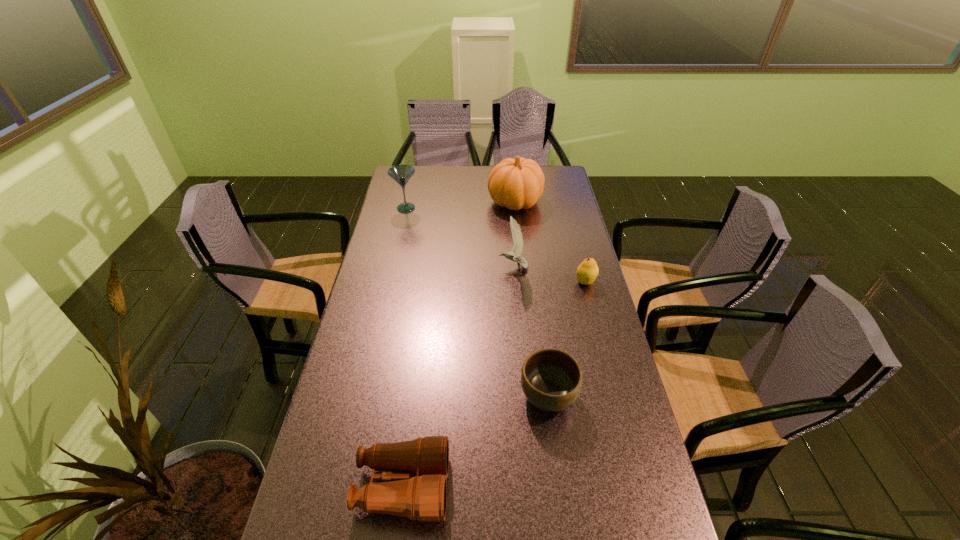
The height and width of the screenshot is (540, 960). Identify the location of object located at the far right corner. (518, 183).

Where is `free space at the left edge`? This screenshot has width=960, height=540. free space at the left edge is located at coordinates (347, 464).

The width and height of the screenshot is (960, 540). I want to click on vacant region at the right edge of the desktop, so click(x=580, y=361).

The image size is (960, 540). Identify the location of vacant area at the far left corner. (406, 186).

I want to click on vacant space at the far right corner of the desktop, so click(562, 189).

Find the location of a particular element. The width and height of the screenshot is (960, 540). free space between the nearest object and the rightmost object is located at coordinates (494, 384).

In order to click on free space between the fifth shortest object and the bowl in this screenshot , I will do `click(477, 302)`.

The height and width of the screenshot is (540, 960). What are the coordinates of `vacant area between the martini and the nearest object` in the screenshot? It's located at (404, 347).

You are a GUI agent. You are given a task and a screenshot of the screen. Output one action in this format:
    pyautogui.click(x=<x>, y=<y>)
    Task: Click on the free space between the martini and the fifth farthest object
    
    Given the screenshot: What is the action you would take?
    pyautogui.click(x=477, y=302)

At what (x,y) coordinates should I click in order to perform the action: click on free space between the rightmost object and the second tallest object. Please return your answer as a coordinate pair (x, y). This screenshot has height=540, width=960. Looking at the image, I should click on (495, 245).